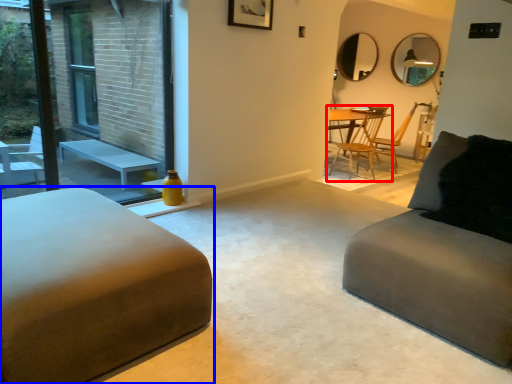
Question: Which object is closer to the camera taking this photo, chair (highlighted by a red box) or studio couch (highlighted by a blue box)?

Choices:
 (A) chair
 (B) studio couch

Answer: (B)